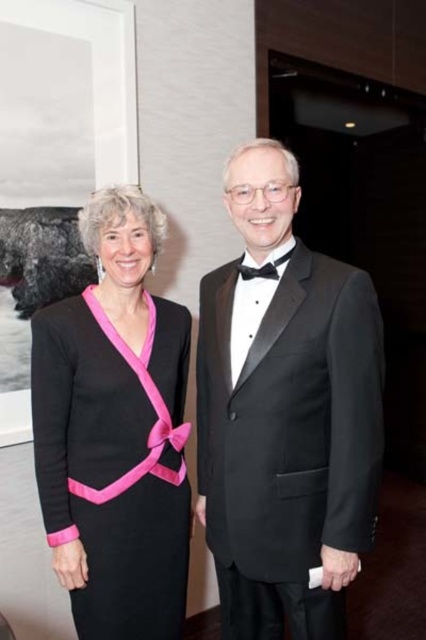
How far apart are black satin tuxedo at center and metallic silver frame at upper left?

The distance of black satin tuxedo at center from metallic silver frame at upper left is 38.54 inches.

Consider the image. Is black satin tuxedo at center to the right of metallic silver frame at upper left from the viewer's perspective?

Correct, you'll find black satin tuxedo at center to the right of metallic silver frame at upper left.

Locate an element on the screen. The height and width of the screenshot is (640, 426). black satin tuxedo at center is located at coordinates (284, 413).

Locate an element on the screen. black satin tuxedo at center is located at coordinates (284, 413).

Is the position of metallic silver frame at upper left more distant than that of pink satin ribbon at center?

Yes, metallic silver frame at upper left is further from the viewer.

Between point (17, 189) and point (92, 292), which one is positioned in front?

Point (92, 292) is in front.

In order to click on metallic silver frame at upper left in this screenshot , I will do `click(66, 99)`.

Does point (173, 493) come behind point (250, 269)?

That is True.

Who is shorter, matte black dress at left or black satin bow tie at center?

Standing shorter between the two is black satin bow tie at center.

The image size is (426, 640). I want to click on matte black dress at left, so click(115, 432).